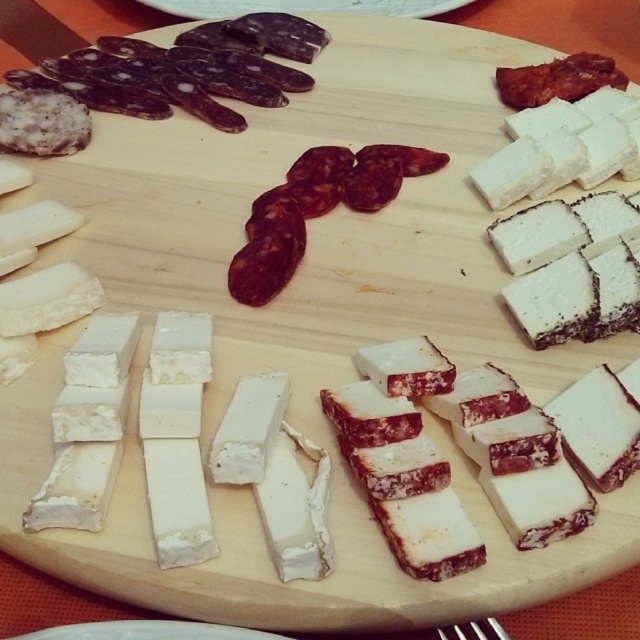
You are arranging a charcuterie board and need to place a metallic silver fork at lower center. Considering the dark red cured meat at center is taller than the fork, will the fork be visible from above the board?

The dark red cured meat at center is taller than the metallic silver fork at lower center, so the fork may be partially or fully obscured from an overhead view depending on their exact positions.

You are hosting a dinner party and want to serve a cheese platter. The cheese needs to be at least 18 inches away from the cured meat to prevent cross contamination. Based on the image, is the distance between the dark red cured meat at center and the white crumbly cheese at center sufficient?

The dark red cured meat at center and the white crumbly cheese at center are 16.82 inches apart from each other, which is less than the required 18 inches. Therefore, the distance is insufficient to prevent cross contamination.

You are a guest at a party and see the dark red cured meat at center and the metallic silver fork at lower center on the charcuterie board. Which object is bigger?

The dark red cured meat at center is larger in size than the metallic silver fork at lower center.